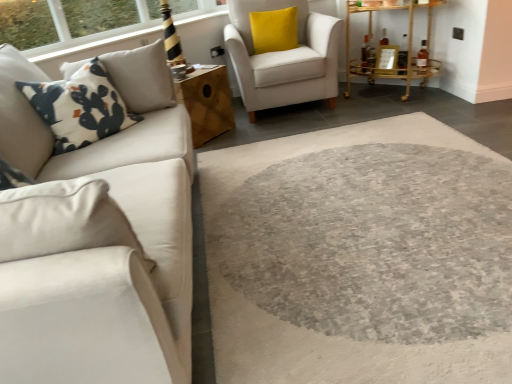
You are a GUI agent. You are given a task and a screenshot of the screen. Output one action in this format:
    pyautogui.click(x=<x>, y=<y>)
    Task: Click on the white printed fabric pillow at left
    The width and height of the screenshot is (512, 384).
    Given the screenshot: What is the action you would take?
    pyautogui.click(x=80, y=107)

What do you see at coordinates (284, 58) in the screenshot?
I see `soft white fabric armchair at center` at bounding box center [284, 58].

What are the coordinates of `gold metallic bar cart at upper right, positioned as the 2th table in left-to-right order` in the screenshot? It's located at [391, 47].

Identify the location of satin white couch at left. (99, 252).

Find the location of a particular element. The width and height of the screenshot is (512, 384). white printed fabric pillow at left is located at coordinates (80, 107).

Considering the relative positions of satin white couch at left and white printed fabric pillow at left in the image provided, is satin white couch at left in front of white printed fabric pillow at left?

That is True.

From the image's perspective, between satin white couch at left and white printed fabric pillow at left, which one is located above?

From the image's view, white printed fabric pillow at left is above.

Considering the sizes of satin white couch at left and white printed fabric pillow at left in the image, is satin white couch at left wider or thinner than white printed fabric pillow at left?

Clearly, satin white couch at left has less width compared to white printed fabric pillow at left.

In the scene shown: Considering the sizes of objects satin white couch at left and white printed fabric pillow at left in the image provided, who is bigger, satin white couch at left or white printed fabric pillow at left?

Bigger between the two is satin white couch at left.

Which of these two, wooden cube at center, the 1th table in the left-to-right sequence, or gold metallic bar cart at upper right, which ranks as the 1th table in right-to-left order, is bigger?

gold metallic bar cart at upper right, which ranks as the 1th table in right-to-left order.

Which of these two, wooden cube at center, the second table positioned from the right, or gold metallic bar cart at upper right, positioned as the 2th table in left-to-right order, stands shorter?

Standing shorter between the two is wooden cube at center, the second table positioned from the right.

Can you confirm if wooden cube at center, the 1th table in the left-to-right sequence, is positioned to the left of gold metallic bar cart at upper right, positioned as the 2th table in left-to-right order?

Indeed, wooden cube at center, the 1th table in the left-to-right sequence, is positioned on the left side of gold metallic bar cart at upper right, positioned as the 2th table in left-to-right order.

Is gold metallic bar cart at upper right, positioned as the 2th table in left-to-right order, looking in the opposite direction of white printed fabric pillow at left?

No, white printed fabric pillow at left is not at the back of gold metallic bar cart at upper right, positioned as the 2th table in left-to-right order.

How distant is gold metallic bar cart at upper right, positioned as the 2th table in left-to-right order, from white printed fabric pillow at left?

Answer: gold metallic bar cart at upper right, positioned as the 2th table in left-to-right order, is 2.50 meters away from white printed fabric pillow at left.

Does gold metallic bar cart at upper right, which ranks as the 1th table in right-to-left order, have a larger size compared to white printed fabric pillow at left?

Correct, gold metallic bar cart at upper right, which ranks as the 1th table in right-to-left order, is larger in size than white printed fabric pillow at left.

From a real-world perspective, which object rests below the other?

In real-world perspective, gold metallic bar cart at upper right, which ranks as the 1th table in right-to-left order, is lower.

Considering the positions of points (333, 79) and (170, 185), is point (333, 79) closer to camera compared to point (170, 185)?

No.

At what (x,y) coordinates should I click in order to perform the action: click on chair behind the satin white couch at left. Please return your answer as a coordinate pair (x, y). This screenshot has width=512, height=384. Looking at the image, I should click on (284, 58).

Is soft white fabric armchair at center further to camera compared to satin white couch at left?

That is True.

Is soft white fabric armchair at center wider or thinner than wooden cube at center, the 1th table in the left-to-right sequence?

In the image, soft white fabric armchair at center appears to be wider than wooden cube at center, the 1th table in the left-to-right sequence.

Between point (249, 98) and point (194, 136), which one is positioned behind?

Positioned behind is point (249, 98).

Between soft white fabric armchair at center and wooden cube at center, the second table positioned from the right, which one has smaller size?

wooden cube at center, the second table positioned from the right.

Can you confirm if soft white fabric armchair at center is taller than wooden cube at center, the 1th table in the left-to-right sequence?

Indeed, soft white fabric armchair at center has a greater height compared to wooden cube at center, the 1th table in the left-to-right sequence.

Is wooden cube at center, the second table positioned from the right, oriented towards satin white couch at left?

No, wooden cube at center, the second table positioned from the right, is not facing towards satin white couch at left.

Measure the distance between wooden cube at center, the 1th table in the left-to-right sequence, and satin white couch at left.

They are 1.40 meters apart.

From the image's perspective, is wooden cube at center, the second table positioned from the right, beneath satin white couch at left?

No, from the image's perspective, wooden cube at center, the second table positioned from the right, is not below satin white couch at left.

Does wooden cube at center, the 1th table in the left-to-right sequence, lie in front of satin white couch at left?

No, wooden cube at center, the 1th table in the left-to-right sequence, is behind satin white couch at left.

Consider the image. Considering the relative sizes of gold metallic bar cart at upper right, which ranks as the 1th table in right-to-left order, and wooden cube at center, the 1th table in the left-to-right sequence, in the image provided, is gold metallic bar cart at upper right, which ranks as the 1th table in right-to-left order, thinner than wooden cube at center, the 1th table in the left-to-right sequence,?

Yes, gold metallic bar cart at upper right, which ranks as the 1th table in right-to-left order, is thinner than wooden cube at center, the 1th table in the left-to-right sequence.

Which is behind, point (413, 61) or point (210, 123)?

Positioned behind is point (413, 61).

How far apart are gold metallic bar cart at upper right, positioned as the 2th table in left-to-right order, and wooden cube at center, the 1th table in the left-to-right sequence?

They are 4.80 feet apart.

Can you confirm if gold metallic bar cart at upper right, which ranks as the 1th table in right-to-left order, is positioned to the right of wooden cube at center, the second table positioned from the right?

Indeed, gold metallic bar cart at upper right, which ranks as the 1th table in right-to-left order, is positioned on the right side of wooden cube at center, the second table positioned from the right.

Where is `studio couch in front of the white printed fabric pillow at left`? studio couch in front of the white printed fabric pillow at left is located at coordinates (99, 252).

Identify the location of table located above the wooden cube at center, the 1th table in the left-to-right sequence (from the image's perspective). (391, 47).

When comparing their distances from white printed fabric pillow at left, does soft white fabric armchair at center or satin white couch at left seem further?

soft white fabric armchair at center.

Based on their spatial positions, is yellow velvet pillow at upper right or white printed fabric pillow at left further from soft white fabric armchair at center?

Among the two, white printed fabric pillow at left is located further to soft white fabric armchair at center.

From the image, which object appears to be farther from soft white fabric armchair at center, white printed fabric pillow at left or wooden cube at center, the 1th table in the left-to-right sequence?

white printed fabric pillow at left is positioned further to the anchor soft white fabric armchair at center.

From the image, which object appears to be farther from wooden cube at center, the 1th table in the left-to-right sequence, yellow velvet pillow at upper right or satin white couch at left?

The object further to wooden cube at center, the 1th table in the left-to-right sequence, is satin white couch at left.

Based on the photo, from the image, which object appears to be farther from wooden cube at center, the 1th table in the left-to-right sequence, gold metallic bar cart at upper right, positioned as the 2th table in left-to-right order, or soft white fabric armchair at center?

gold metallic bar cart at upper right, positioned as the 2th table in left-to-right order.

Estimate the real-world distances between objects in this image. Which object is closer to white printed fabric pillow at left, gold metallic bar cart at upper right, positioned as the 2th table in left-to-right order, or soft white fabric armchair at center?

Among the two, soft white fabric armchair at center is located nearer to white printed fabric pillow at left.

When comparing their distances from white printed fabric pillow at left, does soft white fabric armchair at center or wooden cube at center, the 1th table in the left-to-right sequence, seem further?

soft white fabric armchair at center lies further to white printed fabric pillow at left than the other object.

Looking at this image, from the image, which object appears to be farther from wooden cube at center, the second table positioned from the right, satin white couch at left or gold metallic bar cart at upper right, positioned as the 2th table in left-to-right order?

The object further to wooden cube at center, the second table positioned from the right, is gold metallic bar cart at upper right, positioned as the 2th table in left-to-right order.

Locate an element on the screen. The image size is (512, 384). throw pillow located between satin white couch at left and gold metallic bar cart at upper right, which ranks as the 1th table in right-to-left order, in the depth direction is located at coordinates (80, 107).

The width and height of the screenshot is (512, 384). I want to click on chair between white printed fabric pillow at left and yellow velvet pillow at upper right from front to back, so click(x=284, y=58).

Locate an element on the screen. table situated between white printed fabric pillow at left and gold metallic bar cart at upper right, which ranks as the 1th table in right-to-left order, from left to right is located at coordinates (207, 102).

Locate an element on the screen. The height and width of the screenshot is (384, 512). throw pillow between satin white couch at left and yellow velvet pillow at upper right in the front-back direction is located at coordinates (80, 107).